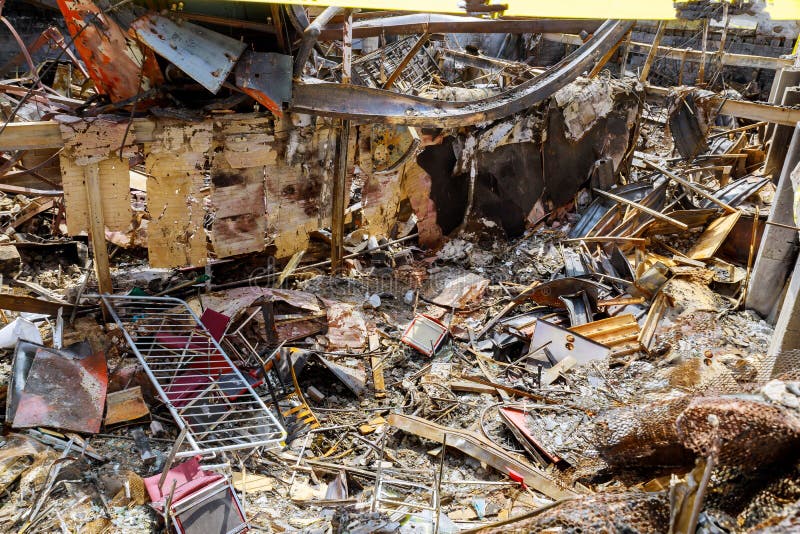
Where is `door`? door is located at coordinates (542, 335).